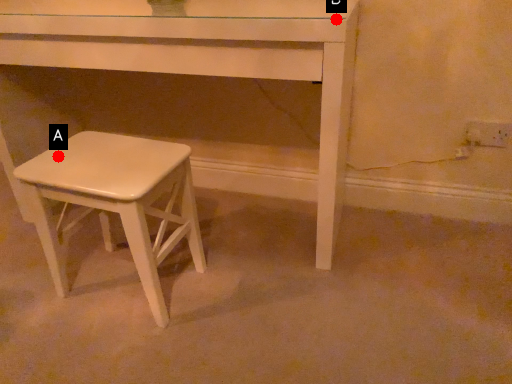
Question: Two points are circled on the image, labeled by A and B beside each circle. Which of the following is the closest to the observer?

Choices:
 (A) A is closer
 (B) B is closer

Answer: (B)